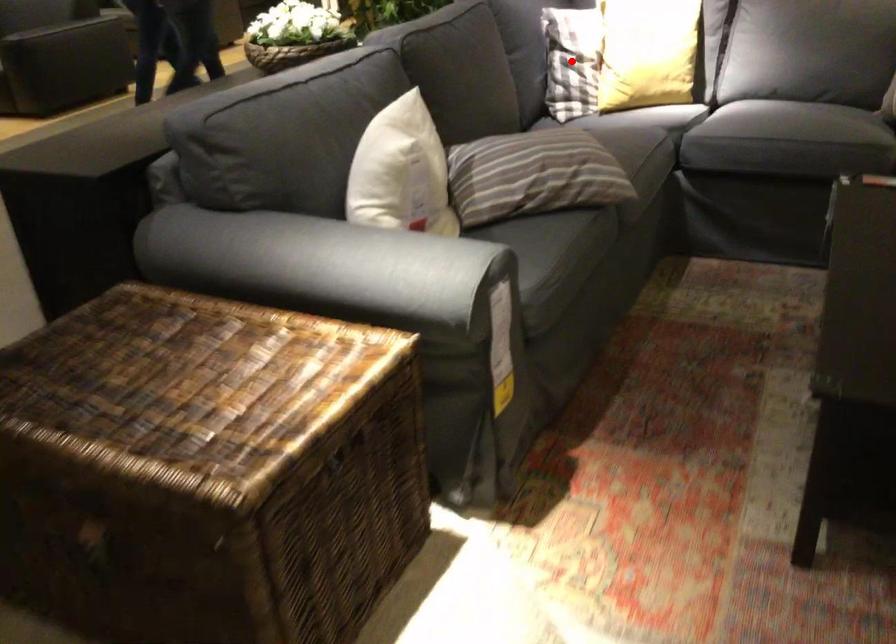
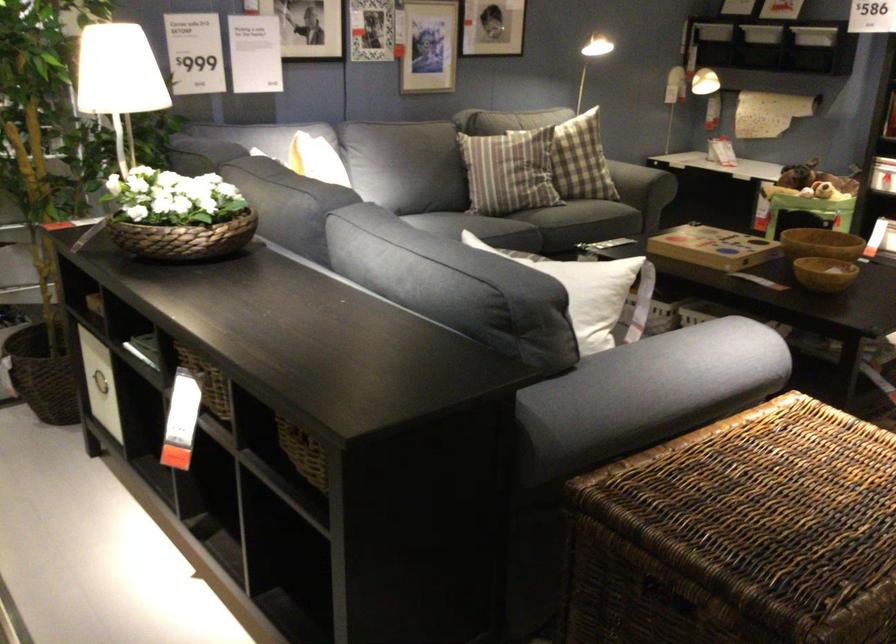
Question: I am providing you with two images of the same scene from different viewpoints. A red point is marked on the first image. At the location where the point appears in image 1, is it still visible in image 2?

Choices:
 (A) Yes
 (B) No

Answer: (B)